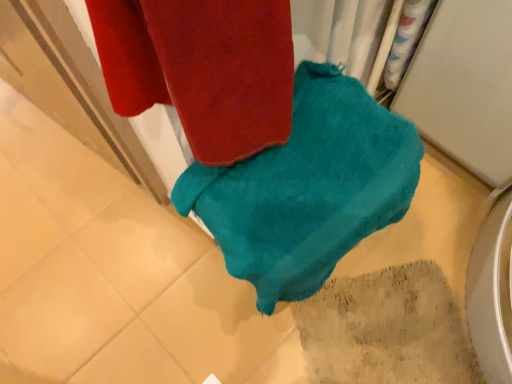
Question: Can you confirm if textured beige rug at lower right is smaller than teal soft towel at center?

Choices:
 (A) no
 (B) yes

Answer: (B)

Question: Is textured beige rug at lower right positioned with its back to teal soft towel at center?

Choices:
 (A) yes
 (B) no

Answer: (B)

Question: Does textured beige rug at lower right have a greater height compared to teal soft towel at center?

Choices:
 (A) yes
 (B) no

Answer: (B)

Question: Is textured beige rug at lower right surrounding teal soft towel at center?

Choices:
 (A) no
 (B) yes

Answer: (A)

Question: From the image's perspective, is textured beige rug at lower right beneath teal soft towel at center?

Choices:
 (A) yes
 (B) no

Answer: (A)

Question: Is textured beige rug at lower right positioned beyond the bounds of teal soft towel at center?

Choices:
 (A) no
 (B) yes

Answer: (B)

Question: Is teal soft towel at center facing towards textured beige rug at lower right?

Choices:
 (A) yes
 (B) no

Answer: (B)

Question: From a real-world perspective, is teal soft towel at center physically below textured beige rug at lower right?

Choices:
 (A) yes
 (B) no

Answer: (B)

Question: From a real-world perspective, is teal soft towel at center physically above textured beige rug at lower right?

Choices:
 (A) no
 (B) yes

Answer: (B)

Question: From the image's perspective, would you say teal soft towel at center is positioned over textured beige rug at lower right?

Choices:
 (A) yes
 (B) no

Answer: (A)

Question: Is teal soft towel at center bigger than textured beige rug at lower right?

Choices:
 (A) yes
 (B) no

Answer: (A)

Question: Is teal soft towel at center oriented away from textured beige rug at lower right?

Choices:
 (A) yes
 (B) no

Answer: (B)

Question: Choose the correct answer: Is teal soft towel at center inside textured beige rug at lower right or outside it?

Choices:
 (A) outside
 (B) inside

Answer: (A)